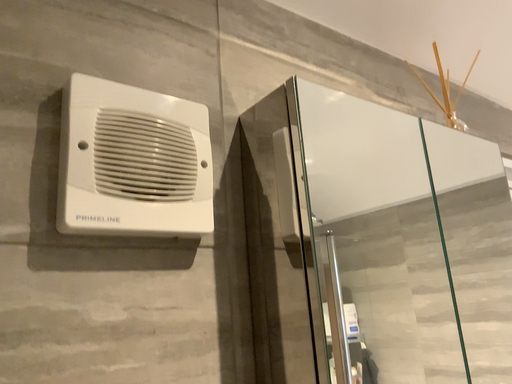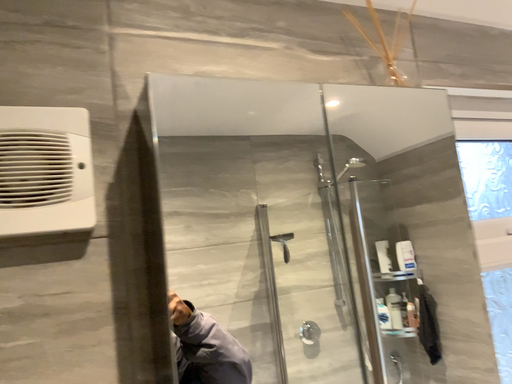
Question: Which way did the camera rotate in the video?

Choices:
 (A) rotated upward
 (B) rotated downward

Answer: (B)